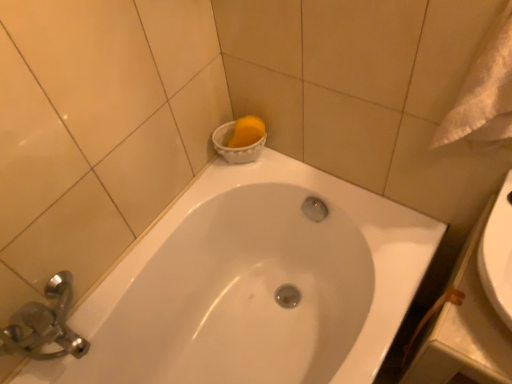
Question: From the image's perspective, is white glossy bathtub at upper center located above or below white textured towel at upper right?

Choices:
 (A) below
 (B) above

Answer: (A)

Question: From a real-world perspective, is white glossy bathtub at upper center physically located above or below white textured towel at upper right?

Choices:
 (A) below
 (B) above

Answer: (A)

Question: Choose the correct answer: Is white glossy bathtub at upper center inside white textured towel at upper right or outside it?

Choices:
 (A) outside
 (B) inside

Answer: (A)

Question: Is white textured towel at upper right bigger or smaller than white glossy bathtub at upper center?

Choices:
 (A) small
 (B) big

Answer: (A)

Question: Is white textured towel at upper right in front of or behind white glossy bathtub at upper center in the image?

Choices:
 (A) behind
 (B) front

Answer: (B)

Question: Is point (x=481, y=54) closer or farther from the camera than point (x=276, y=218)?

Choices:
 (A) closer
 (B) farther

Answer: (A)

Question: Is white textured towel at upper right to the left or to the right of white glossy bathtub at upper center in the image?

Choices:
 (A) left
 (B) right

Answer: (B)